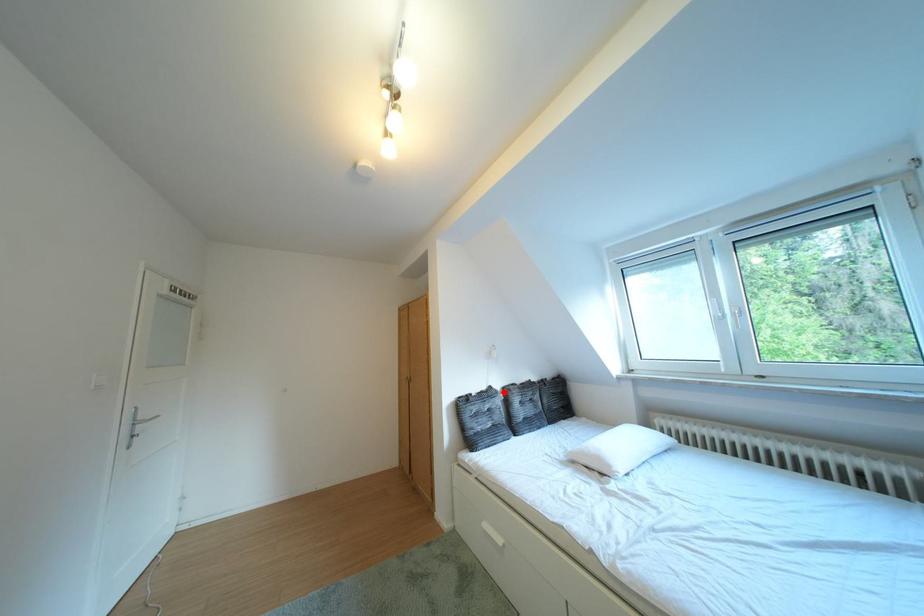
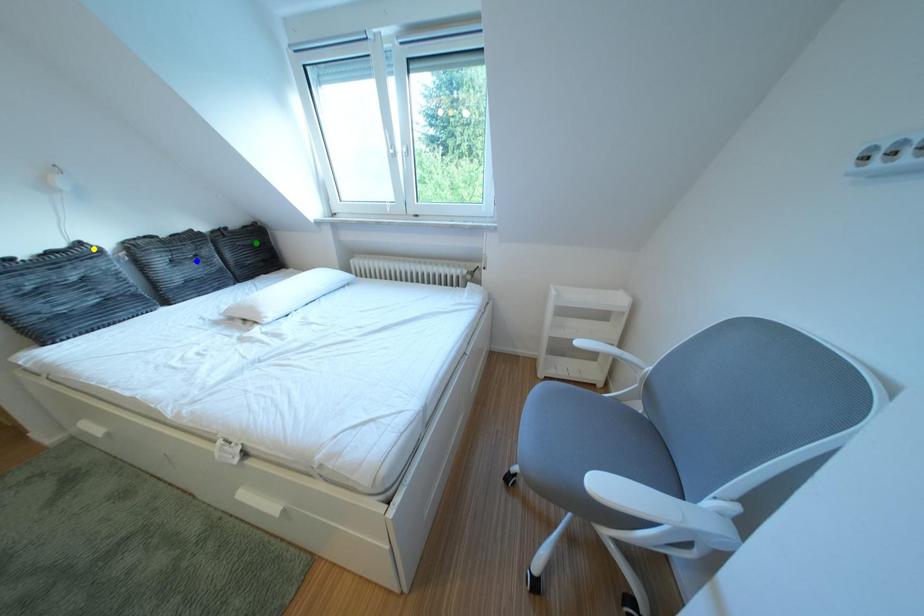
Question: I am providing you with two images of the same scene from different viewpoints. A red point is marked on the first image. You are given multiple points on the second image. Which mark in image 2 goes with the point in image 1?

Choices:
 (A) blue point
 (B) yellow point
 (C) green point

Answer: (B)